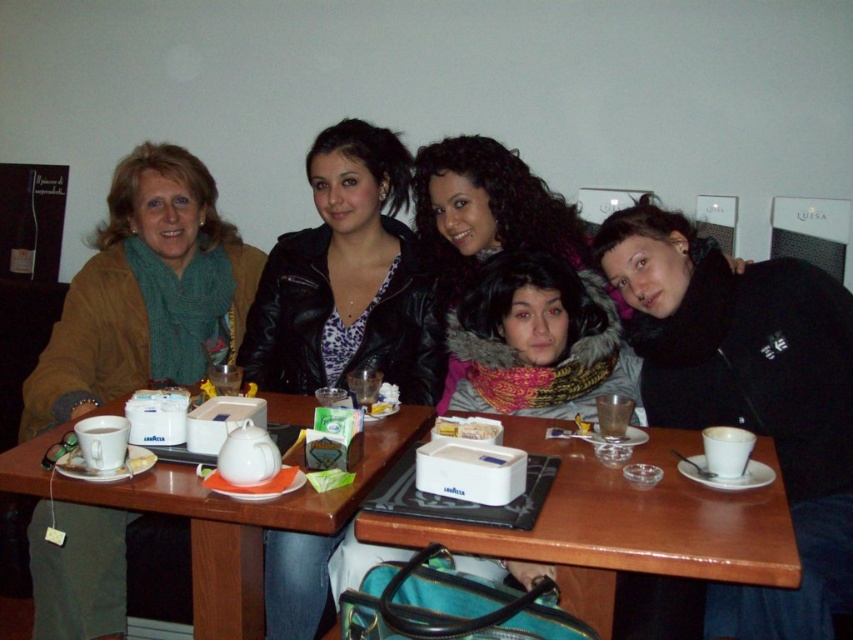
Is leather jacket at center taller than white matte cup at lower right?

Yes.

Is leather jacket at center positioned before white matte cup at lower right?

No.

What do you see at coordinates (347, 280) in the screenshot? The image size is (853, 640). I see `leather jacket at center` at bounding box center [347, 280].

I want to click on leather jacket at center, so (x=347, y=280).

The width and height of the screenshot is (853, 640). What do you see at coordinates (146, 292) in the screenshot?
I see `green knitted scarf at left` at bounding box center [146, 292].

In the scene shown: Is green knitted scarf at left bigger than white ceramic cup at left?

Yes, green knitted scarf at left is bigger than white ceramic cup at left.

The width and height of the screenshot is (853, 640). What are the coordinates of `green knitted scarf at left` in the screenshot? It's located at tap(146, 292).

Who is shorter, white matte cup at lower right or white plastic container at center?

white plastic container at center is shorter.

Who is lower down, white matte cup at lower right or white plastic container at center?

Result: white matte cup at lower right is below.

Where is `white matte cup at lower right`? The height and width of the screenshot is (640, 853). white matte cup at lower right is located at coordinates (726, 451).